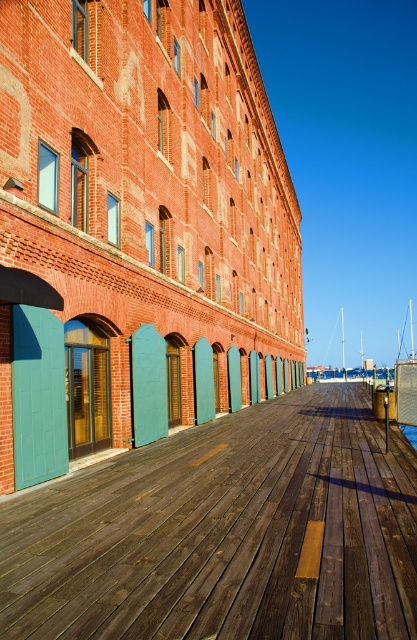
You are a delivery person trying to navigate a narrow cart through the wooden dock at center and the blue water at lower center. Which path is wider for your cart to pass through?

The wooden dock at center is wider than the blue water at lower center, so the cart can pass through the wooden dock at center more easily.

You are standing at point A with coordinates point A at (190, 481). You want to walk to point B which is 8.27 meters away. Is there enough space between the wooden pier and the brick building to walk straight to point B?

Yes, there is enough space between the wooden pier and the brick building to walk straight to point B since they are 8.27 meters apart.